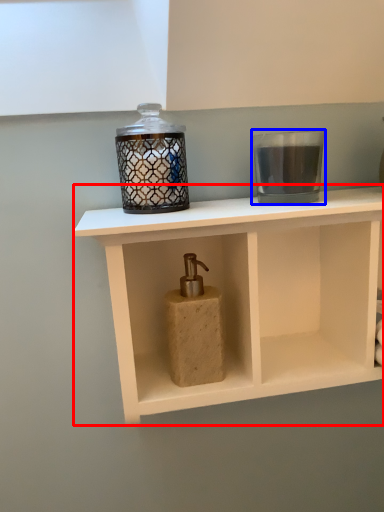
Question: Which object is closer to the camera taking this photo, shelf (highlighted by a red box) or candle holder (highlighted by a blue box)?

Choices:
 (A) shelf
 (B) candle holder

Answer: (A)